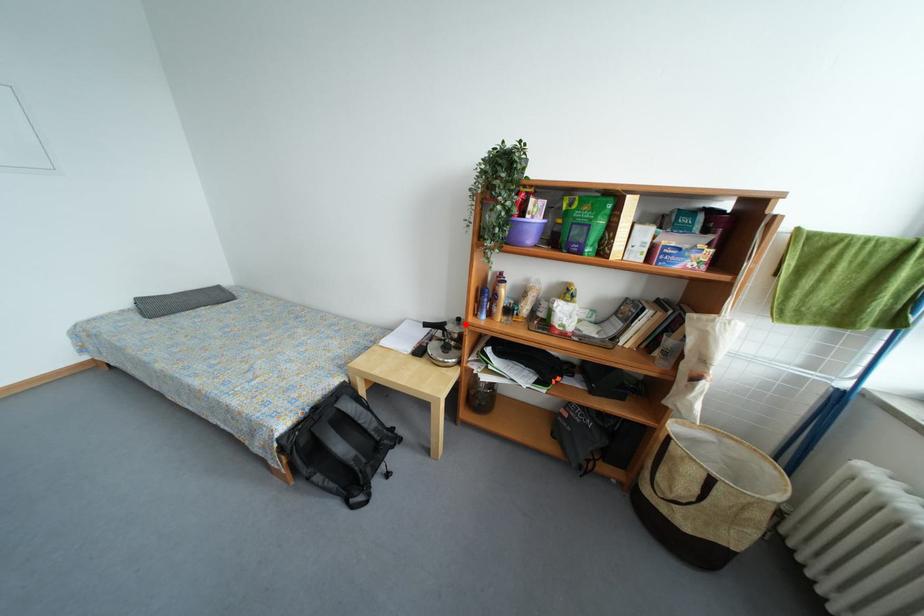
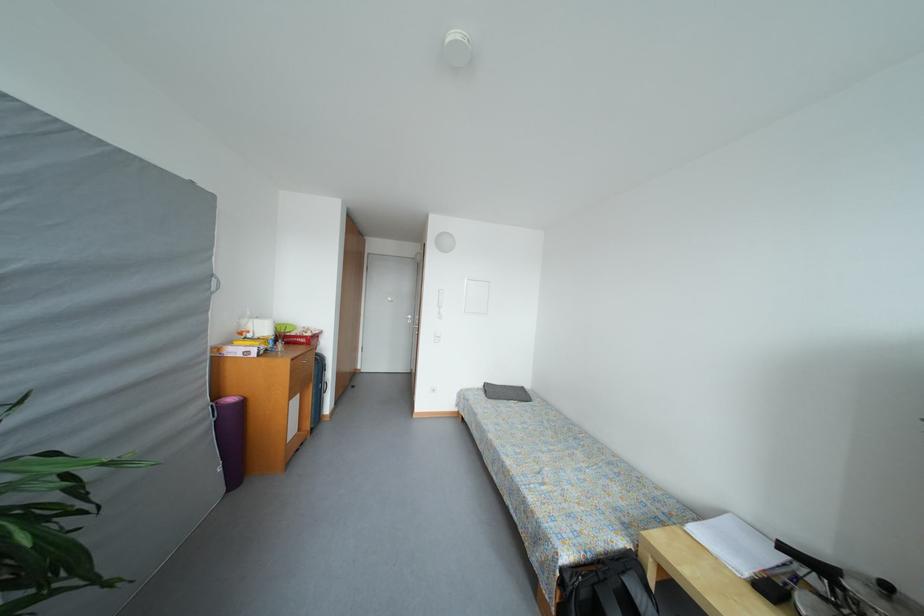
Question: I am providing you with two images of the same scene from different viewpoints. Image1 has a red point marked. In image2, the corresponding 3D location appears at what relative position? Reply with the corresponding letter.

Choices:
 (A) Closer
 (B) Farther

Answer: (B)